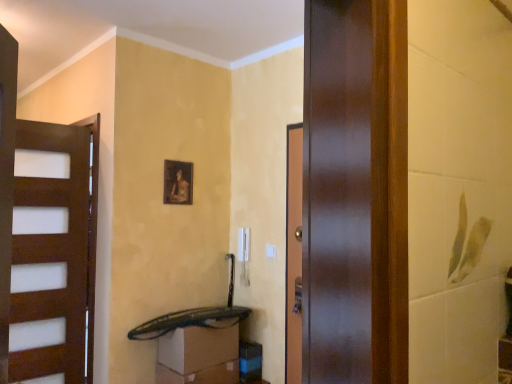
Identify the location of matte white drawer at lower center, which appears as the 2th drawer when viewed from the top. [x=200, y=375].

I want to click on matte wooden picture frame at center, so click(178, 182).

Which is in front, black plastic drawer at lower center, placed as the 1th drawer when sorted from top to bottom, or matte wooden picture frame at center?

black plastic drawer at lower center, placed as the 1th drawer when sorted from top to bottom.

In order to click on picture frame that is above the black plastic drawer at lower center, placed as the 1th drawer when sorted from top to bottom (from the image's perspective) in this screenshot , I will do `click(178, 182)`.

Based on the photo, from the image's perspective, is black plastic drawer at lower center, placed as the 1th drawer when sorted from top to bottom, on top of matte wooden picture frame at center?

No, from the image's perspective, black plastic drawer at lower center, placed as the 1th drawer when sorted from top to bottom, is not above matte wooden picture frame at center.

Between black plastic drawer at lower center, which is the 2th drawer in bottom-to-top order, and matte wooden picture frame at center, which one has larger size?

black plastic drawer at lower center, which is the 2th drawer in bottom-to-top order, is bigger.

Is there a large distance between matte wooden picture frame at center and black plastic drawer at lower center, placed as the 1th drawer when sorted from top to bottom?

No, matte wooden picture frame at center is not far away from black plastic drawer at lower center, placed as the 1th drawer when sorted from top to bottom.

From the matte wooden picture frame at center, count 1st drawers forward and point to it. Please provide its 2D coordinates.

[(198, 348)]

Considering the relative sizes of matte wooden picture frame at center and black plastic drawer at lower center, which is the 2th drawer in bottom-to-top order, in the image provided, is matte wooden picture frame at center thinner than black plastic drawer at lower center, which is the 2th drawer in bottom-to-top order,?

Indeed, matte wooden picture frame at center has a lesser width compared to black plastic drawer at lower center, which is the 2th drawer in bottom-to-top order.

From a real-world perspective, who is located lower, matte white drawer at lower center, the 1th drawer ordered from the bottom, or black plastic drawer at lower center, placed as the 1th drawer when sorted from top to bottom?

matte white drawer at lower center, the 1th drawer ordered from the bottom.

In the scene shown: Is matte white drawer at lower center, which appears as the 2th drawer when viewed from the top, facing towards black plastic drawer at lower center, placed as the 1th drawer when sorted from top to bottom?

No, matte white drawer at lower center, which appears as the 2th drawer when viewed from the top, is not turned towards black plastic drawer at lower center, placed as the 1th drawer when sorted from top to bottom.

In the scene shown: Which of these two, matte white drawer at lower center, the 1th drawer ordered from the bottom, or black plastic drawer at lower center, placed as the 1th drawer when sorted from top to bottom, is smaller?

With smaller size is matte white drawer at lower center, the 1th drawer ordered from the bottom.

Is the surface of matte white drawer at lower center, which appears as the 2th drawer when viewed from the top, in direct contact with black plastic drawer at lower center, placed as the 1th drawer when sorted from top to bottom?

Yes, the surface of matte white drawer at lower center, which appears as the 2th drawer when viewed from the top, is in contact with black plastic drawer at lower center, placed as the 1th drawer when sorted from top to bottom.

Is matte white drawer at lower center, the 1th drawer ordered from the bottom, not close to matte wooden picture frame at center?

Yes, matte white drawer at lower center, the 1th drawer ordered from the bottom, and matte wooden picture frame at center are quite far apart.

From a real-world perspective, is matte white drawer at lower center, the 1th drawer ordered from the bottom, positioned under matte wooden picture frame at center based on gravity?

Correct, in the physical world, matte white drawer at lower center, the 1th drawer ordered from the bottom, is lower than matte wooden picture frame at center.

Is matte white drawer at lower center, the 1th drawer ordered from the bottom, inside or outside of matte wooden picture frame at center?

matte white drawer at lower center, the 1th drawer ordered from the bottom, cannot be found inside matte wooden picture frame at center.

Considering their positions, is matte wooden picture frame at center located in front of or behind matte white drawer at lower center, which appears as the 2th drawer when viewed from the top?

Clearly, matte wooden picture frame at center is behind matte white drawer at lower center, which appears as the 2th drawer when viewed from the top.

Is matte white drawer at lower center, which appears as the 2th drawer when viewed from the top, surrounded by matte wooden picture frame at center?

No, matte white drawer at lower center, which appears as the 2th drawer when viewed from the top, is not inside matte wooden picture frame at center.

Does point (184, 186) come behind point (160, 368)?

Yes, point (184, 186) is farther from viewer.

Is black plastic drawer at lower center, which is the 2th drawer in bottom-to-top order, located outside matte white drawer at lower center, which appears as the 2th drawer when viewed from the top?

Indeed, black plastic drawer at lower center, which is the 2th drawer in bottom-to-top order, is completely outside matte white drawer at lower center, which appears as the 2th drawer when viewed from the top.

From the image's perspective, is black plastic drawer at lower center, which is the 2th drawer in bottom-to-top order, under matte white drawer at lower center, the 1th drawer ordered from the bottom?

Incorrect, from the image's perspective, black plastic drawer at lower center, which is the 2th drawer in bottom-to-top order, is higher than matte white drawer at lower center, the 1th drawer ordered from the bottom.

Could you measure the distance between black plastic drawer at lower center, placed as the 1th drawer when sorted from top to bottom, and matte white drawer at lower center, the 1th drawer ordered from the bottom?

They are 3.83 inches apart.

Considering the sizes of objects black plastic drawer at lower center, placed as the 1th drawer when sorted from top to bottom, and matte white drawer at lower center, which appears as the 2th drawer when viewed from the top, in the image provided, who is shorter, black plastic drawer at lower center, placed as the 1th drawer when sorted from top to bottom, or matte white drawer at lower center, which appears as the 2th drawer when viewed from the top,?

Standing shorter between the two is matte white drawer at lower center, which appears as the 2th drawer when viewed from the top.

The height and width of the screenshot is (384, 512). What are the coordinates of `picture frame that is behind the black plastic drawer at lower center, placed as the 1th drawer when sorted from top to bottom` in the screenshot? It's located at (178, 182).

Locate an element on the screen. picture frame located above the black plastic drawer at lower center, placed as the 1th drawer when sorted from top to bottom (from the image's perspective) is located at coordinates (178, 182).

In the scene shown: Which object lies further to the anchor point matte wooden picture frame at center, matte white drawer at lower center, which appears as the 2th drawer when viewed from the top, or black plastic drawer at lower center, which is the 2th drawer in bottom-to-top order?

matte white drawer at lower center, which appears as the 2th drawer when viewed from the top, is further to matte wooden picture frame at center.

Considering their positions, is matte wooden picture frame at center positioned closer to black plastic drawer at lower center, which is the 2th drawer in bottom-to-top order, than matte white drawer at lower center, which appears as the 2th drawer when viewed from the top?

matte white drawer at lower center, which appears as the 2th drawer when viewed from the top.

Looking at the image, which one is located closer to black plastic drawer at lower center, placed as the 1th drawer when sorted from top to bottom, matte white drawer at lower center, which appears as the 2th drawer when viewed from the top, or matte wooden picture frame at center?

Among the two, matte white drawer at lower center, which appears as the 2th drawer when viewed from the top, is located nearer to black plastic drawer at lower center, placed as the 1th drawer when sorted from top to bottom.

Considering their positions, is matte wooden picture frame at center positioned closer to matte white drawer at lower center, the 1th drawer ordered from the bottom, than black plastic drawer at lower center, placed as the 1th drawer when sorted from top to bottom?

Based on the image, black plastic drawer at lower center, placed as the 1th drawer when sorted from top to bottom, appears to be nearer to matte white drawer at lower center, the 1th drawer ordered from the bottom.

From the image, which object appears to be farther from matte white drawer at lower center, the 1th drawer ordered from the bottom, black plastic drawer at lower center, which is the 2th drawer in bottom-to-top order, or matte wooden picture frame at center?

matte wooden picture frame at center is positioned further to the anchor matte white drawer at lower center, the 1th drawer ordered from the bottom.

Based on the photo, estimate the real-world distances between objects in this image. Which object is closer to matte wooden picture frame at center, black plastic drawer at lower center, placed as the 1th drawer when sorted from top to bottom, or matte white drawer at lower center, which appears as the 2th drawer when viewed from the top?

The object closer to matte wooden picture frame at center is black plastic drawer at lower center, placed as the 1th drawer when sorted from top to bottom.

At what (x,y) coordinates should I click in order to perform the action: click on drawer between matte wooden picture frame at center and matte white drawer at lower center, the 1th drawer ordered from the bottom, from top to bottom. Please return your answer as a coordinate pair (x, y). This screenshot has width=512, height=384. Looking at the image, I should click on (198, 348).